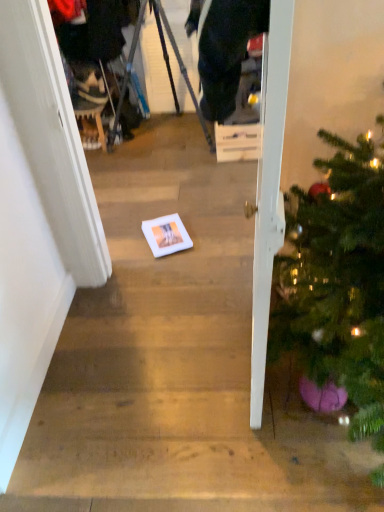
Question: From a real-world perspective, is white cardboard box at center positioned above or below metallic tripod at center?

Choices:
 (A) below
 (B) above

Answer: (A)

Question: Would you say white cardboard box at center is inside or outside metallic tripod at center?

Choices:
 (A) outside
 (B) inside

Answer: (A)

Question: Which of these objects is positioned farthest from the metallic tripod at center?

Choices:
 (A) white cardboard box at center
 (B) white glossy door at right

Answer: (B)

Question: Estimate the real-world distances between objects in this image. Which object is closer to the metallic tripod at center?

Choices:
 (A) white glossy door at right
 (B) white cardboard box at center

Answer: (B)